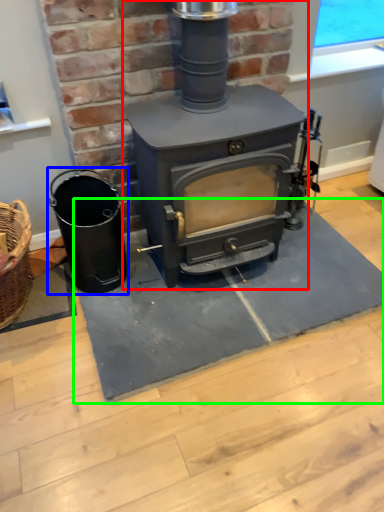
Question: Which object is the closest to the wood burning stove (highlighted by a red box)? Choose among these: appliance (highlighted by a blue box) or doormat (highlighted by a green box).

Choices:
 (A) appliance
 (B) doormat

Answer: (A)